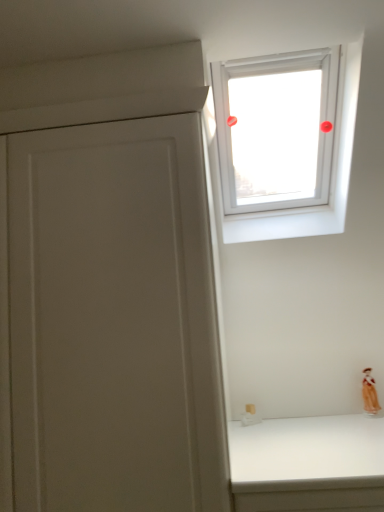
The image size is (384, 512). What do you see at coordinates (276, 134) in the screenshot?
I see `transparent glass window at upper center` at bounding box center [276, 134].

Find the location of a particular element. transparent glass window at upper center is located at coordinates (276, 134).

Where is `matte orange figurine at lower right`? The image size is (384, 512). matte orange figurine at lower right is located at coordinates (369, 393).

What do you see at coordinates (369, 393) in the screenshot? The height and width of the screenshot is (512, 384). I see `matte orange figurine at lower right` at bounding box center [369, 393].

Find the location of a particular element. The height and width of the screenshot is (512, 384). transparent glass window at upper center is located at coordinates (276, 134).

Considering the positions of objects matte orange figurine at lower right and transparent glass window at upper center in the image provided, who is more to the left, matte orange figurine at lower right or transparent glass window at upper center?

transparent glass window at upper center is more to the left.

Is matte orange figurine at lower right in front of or behind transparent glass window at upper center in the image?

matte orange figurine at lower right is positioned farther from the viewer than transparent glass window at upper center.

Is point (376, 410) more distant than point (334, 112)?

That is False.

From the image's perspective, would you say matte orange figurine at lower right is shown under transparent glass window at upper center?

Correct, matte orange figurine at lower right appears lower than transparent glass window at upper center in the image.

From a real-world perspective, which is physically above, matte orange figurine at lower right or transparent glass window at upper center?

transparent glass window at upper center is physically above.

Considering the sizes of matte orange figurine at lower right and transparent glass window at upper center in the image, is matte orange figurine at lower right wider or thinner than transparent glass window at upper center?

In the image, matte orange figurine at lower right appears to be more narrow than transparent glass window at upper center.

Considering the sizes of objects matte orange figurine at lower right and transparent glass window at upper center in the image provided, who is shorter, matte orange figurine at lower right or transparent glass window at upper center?

matte orange figurine at lower right is shorter.

Which of these two, matte orange figurine at lower right or transparent glass window at upper center, is bigger?

transparent glass window at upper center is bigger.

In the scene shown: Is matte orange figurine at lower right inside the boundaries of transparent glass window at upper center, or outside?

matte orange figurine at lower right is outside transparent glass window at upper center.

Can you see matte orange figurine at lower right touching transparent glass window at upper center?

matte orange figurine at lower right is not next to transparent glass window at upper center, and they're not touching.

Is matte orange figurine at lower right oriented away from transparent glass window at upper center?

No, matte orange figurine at lower right is not facing the opposite direction of transparent glass window at upper center.

Identify the location of window in front of the matte orange figurine at lower right. The image size is (384, 512). (276, 134).

Considering the positions of objects transparent glass window at upper center and matte orange figurine at lower right in the image provided, who is more to the left, transparent glass window at upper center or matte orange figurine at lower right?

From the viewer's perspective, transparent glass window at upper center appears more on the left side.

Looking at this image, which is in front, transparent glass window at upper center or matte orange figurine at lower right?

transparent glass window at upper center.

Which is closer, (266,56) or (364,375)?

The point (266,56) is closer.

From the image's perspective, does transparent glass window at upper center appear higher than matte orange figurine at lower right?

Yes, from the image's perspective, transparent glass window at upper center is above matte orange figurine at lower right.

Looking at this image, from a real-world perspective, which object stands above the other?

transparent glass window at upper center, from a real-world perspective.

Based on the photo, considering the sizes of transparent glass window at upper center and matte orange figurine at lower right in the image, is transparent glass window at upper center wider or thinner than matte orange figurine at lower right?

Considering their sizes, transparent glass window at upper center looks broader than matte orange figurine at lower right.

Which of these two, transparent glass window at upper center or matte orange figurine at lower right, stands taller?

With more height is transparent glass window at upper center.

Who is bigger, transparent glass window at upper center or matte orange figurine at lower right?

With larger size is transparent glass window at upper center.

Would you say transparent glass window at upper center contains matte orange figurine at lower right?

That's incorrect, matte orange figurine at lower right is not inside transparent glass window at upper center.

Is transparent glass window at upper center far from matte orange figurine at lower right?

That's right, there is a large distance between transparent glass window at upper center and matte orange figurine at lower right.

Is transparent glass window at upper center oriented away from matte orange figurine at lower right?

No, transparent glass window at upper center's orientation is not away from matte orange figurine at lower right.

Could you measure the distance between transparent glass window at upper center and matte orange figurine at lower right?

transparent glass window at upper center is 3.35 feet away from matte orange figurine at lower right.

Where is `window positioned vertically above the matte orange figurine at lower right (from a real-world perspective)`? This screenshot has height=512, width=384. window positioned vertically above the matte orange figurine at lower right (from a real-world perspective) is located at coordinates (276, 134).

The width and height of the screenshot is (384, 512). In order to click on window above the matte orange figurine at lower right (from the image's perspective) in this screenshot , I will do `click(276, 134)`.

Where is `figurine directly beneath the transparent glass window at upper center (from a real-world perspective)`? figurine directly beneath the transparent glass window at upper center (from a real-world perspective) is located at coordinates click(x=369, y=393).